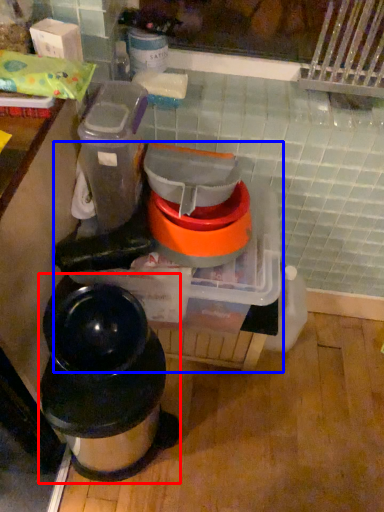
Question: Which of the following is the closest to the observer, waste container (highlighted by a red box) or appliance (highlighted by a blue box)?

Choices:
 (A) waste container
 (B) appliance

Answer: (A)